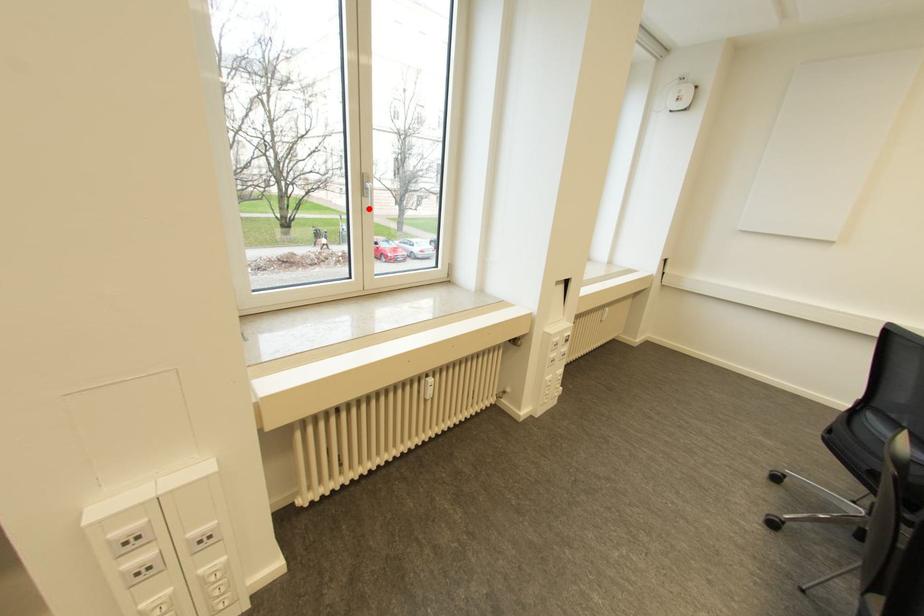
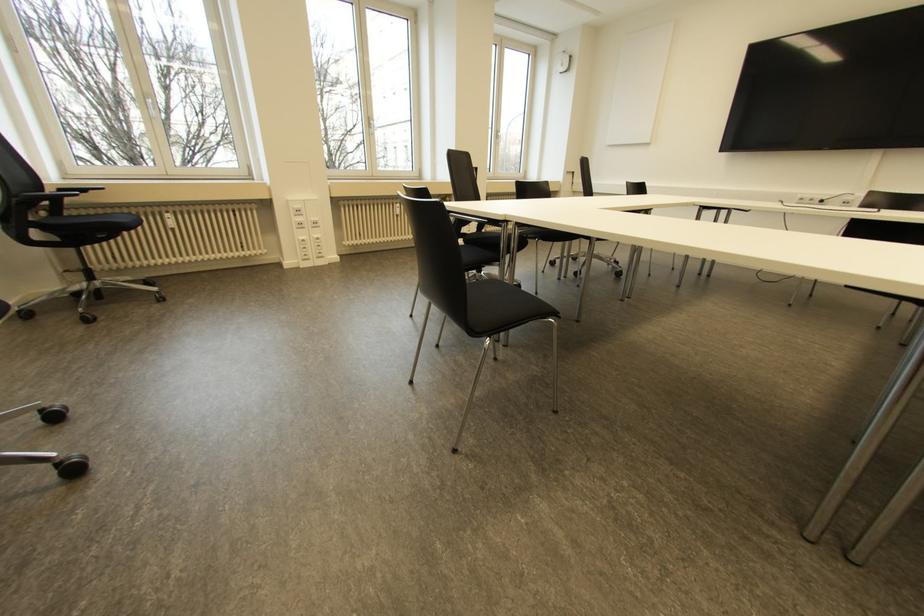
Question: I am providing you with two images of the same scene from different viewpoints. A red point is marked on the first image. Is the red point's position out of view in image 2?

Choices:
 (A) Yes
 (B) No

Answer: (B)